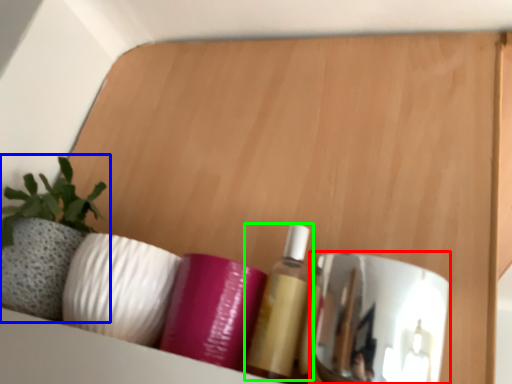
Question: Which object is the farthest from mirror (highlighted by a red box)? Choose among these: houseplant (highlighted by a blue box) or toiletry (highlighted by a green box).

Choices:
 (A) houseplant
 (B) toiletry

Answer: (A)